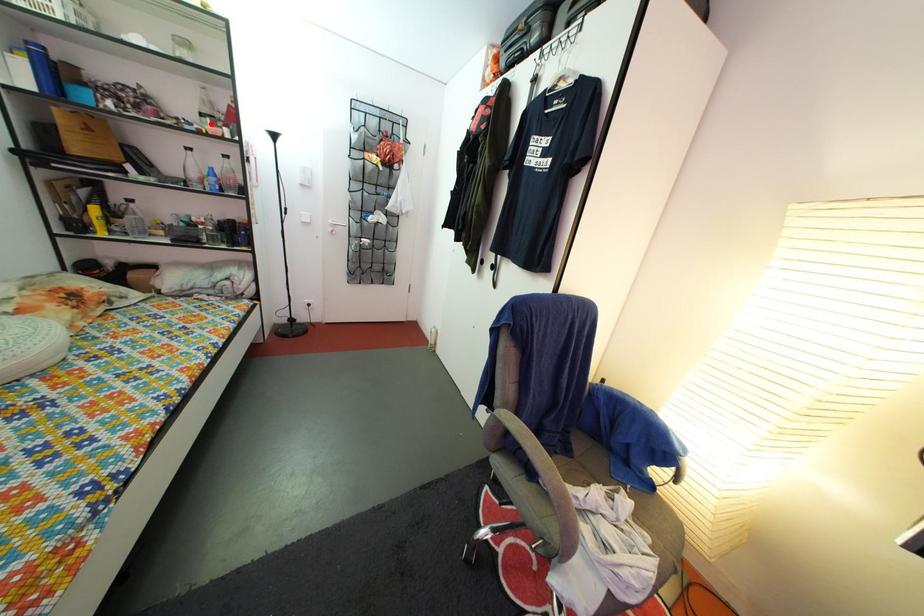
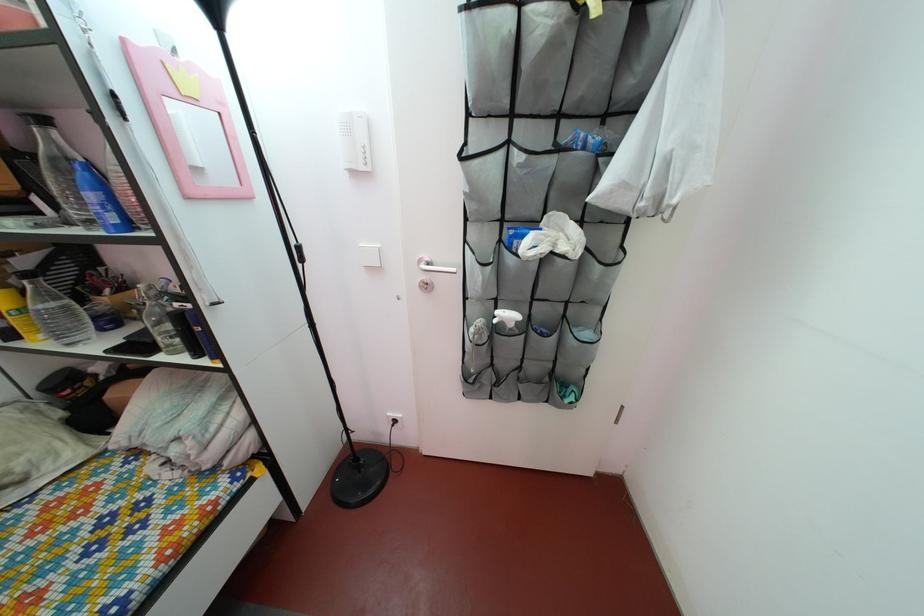
Question: I am providing you with two images of the same scene from different viewpoints. A red point is marked on the first image. At the location where the point appears in image 1, is it still visible in image 2?

Choices:
 (A) Yes
 (B) No

Answer: (B)